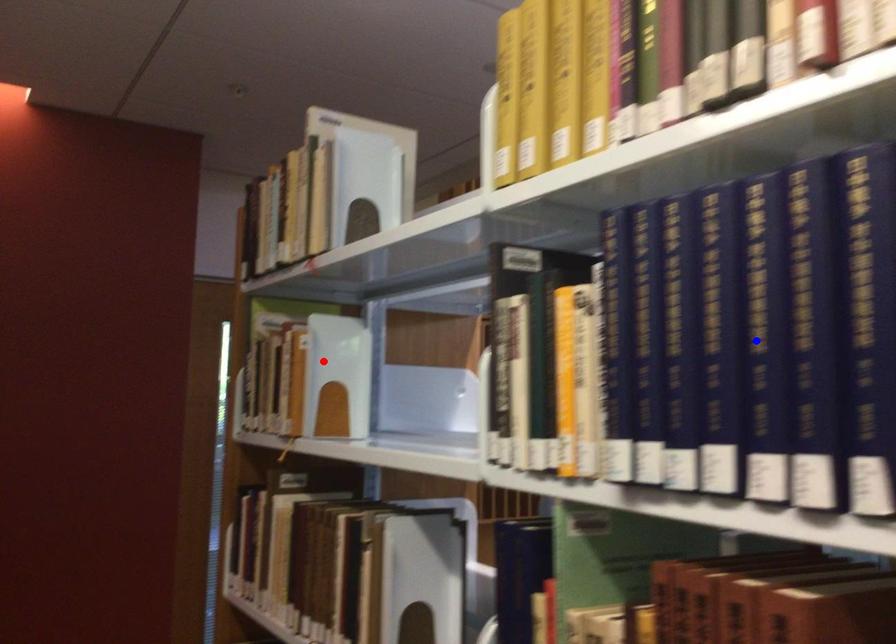
Question: In the image, two points are highlighted. Which point is nearer to the camera? Reply with the corresponding letter.

Choices:
 (A) blue point
 (B) red point

Answer: (A)